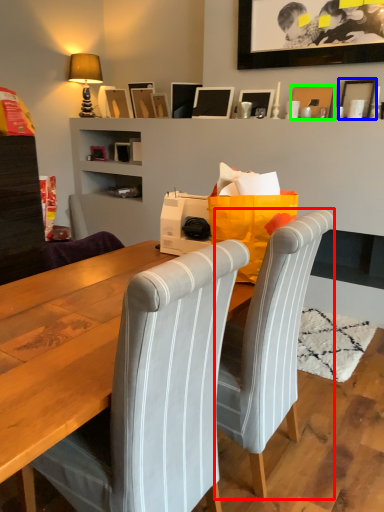
Question: Which is nearer to the chair (highlighted by a red box)? picture frame (highlighted by a blue box) or picture frame (highlighted by a green box).

Choices:
 (A) picture frame
 (B) picture frame

Answer: (A)